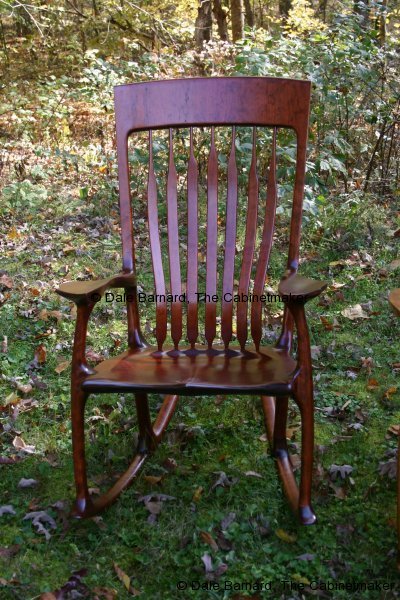
At what (x,y) coordinates should I click in order to perform the action: click on left armrest of rocking chair. Please return your answer as a coordinate pair (x, y). Looking at the image, I should click on (302, 284).